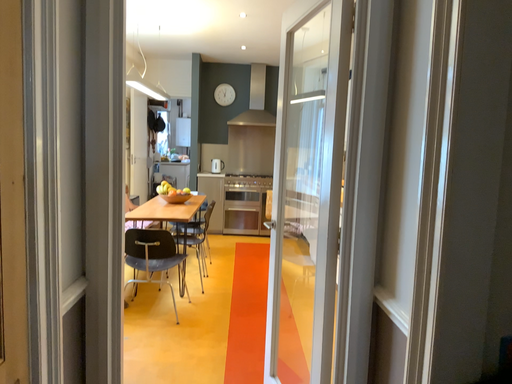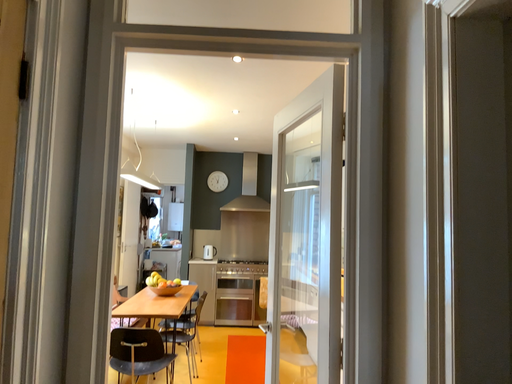
Question: How did the camera likely rotate when shooting the video?

Choices:
 (A) rotated upward
 (B) rotated downward

Answer: (A)